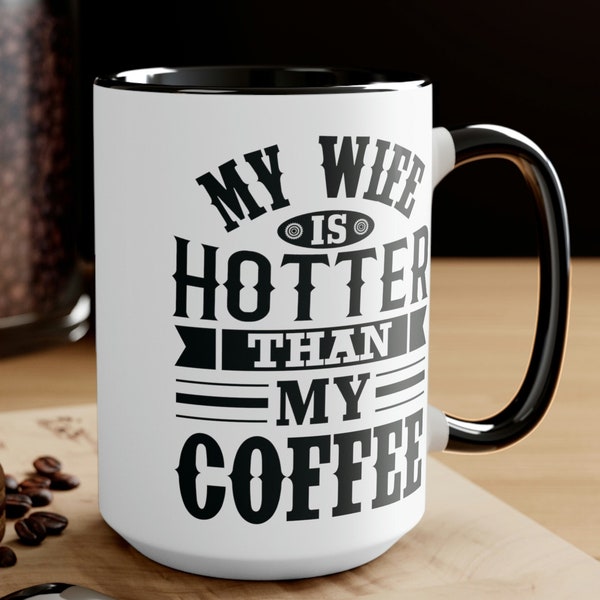
This screenshot has height=600, width=600. What are the coordinates of `white countertop mug is sitting on` in the screenshot? It's located at (428, 561).